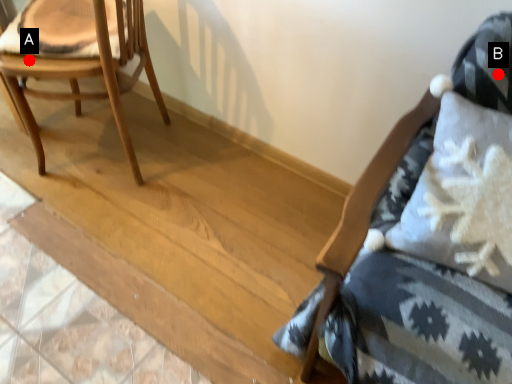
Question: Two points are circled on the image, labeled by A and B beside each circle. Which point is further to the camera?

Choices:
 (A) A is further
 (B) B is further

Answer: (A)